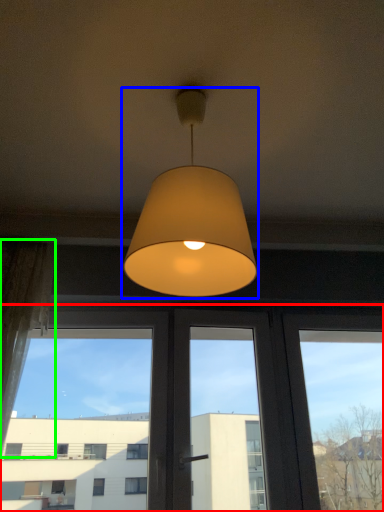
Question: Estimate the real-world distances between objects in this image. Which object is closer to window (highlighted by a red box), lamp (highlighted by a blue box) or curtain (highlighted by a green box)?

Choices:
 (A) lamp
 (B) curtain

Answer: (B)